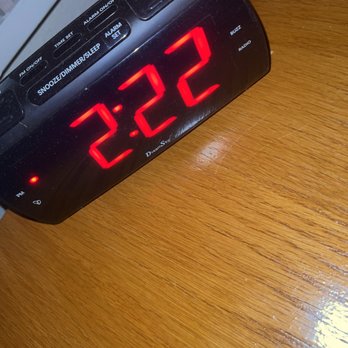
At what (x,y) coordinates should I click in order to perform the action: click on counter. Please return your answer as a coordinate pair (x, y). Looking at the image, I should click on (196, 290).